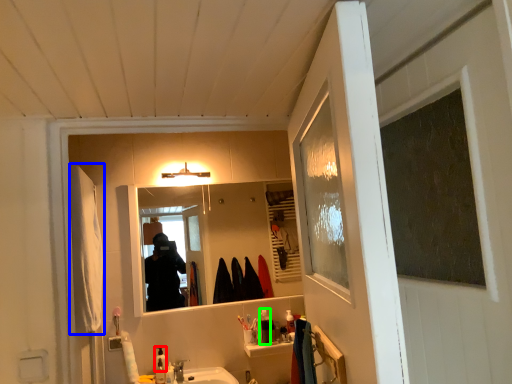
Question: Considering the real-world distances, which object is farthest from toiletry (highlighted by a red box)? robe (highlighted by a blue box) or toiletry (highlighted by a green box)?

Choices:
 (A) robe
 (B) toiletry

Answer: (A)